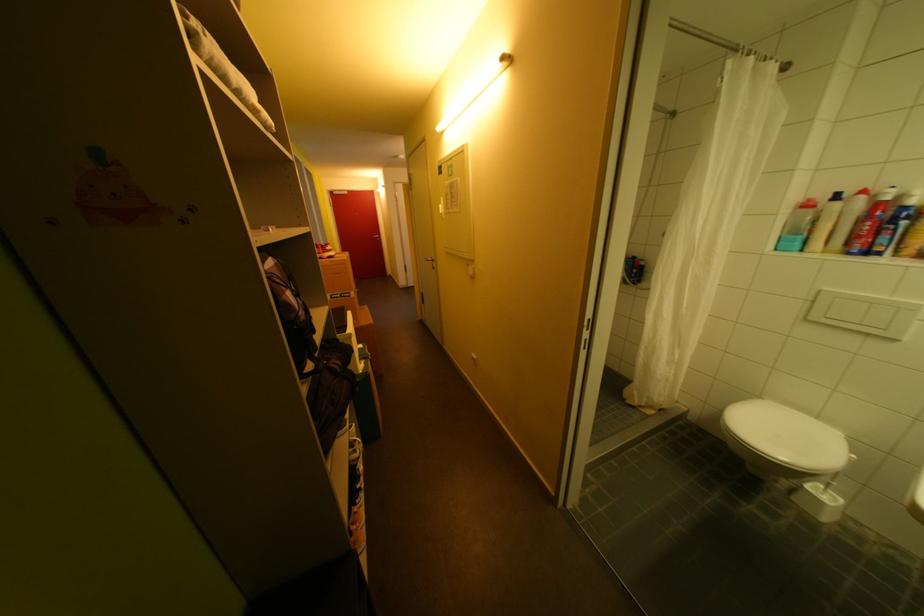
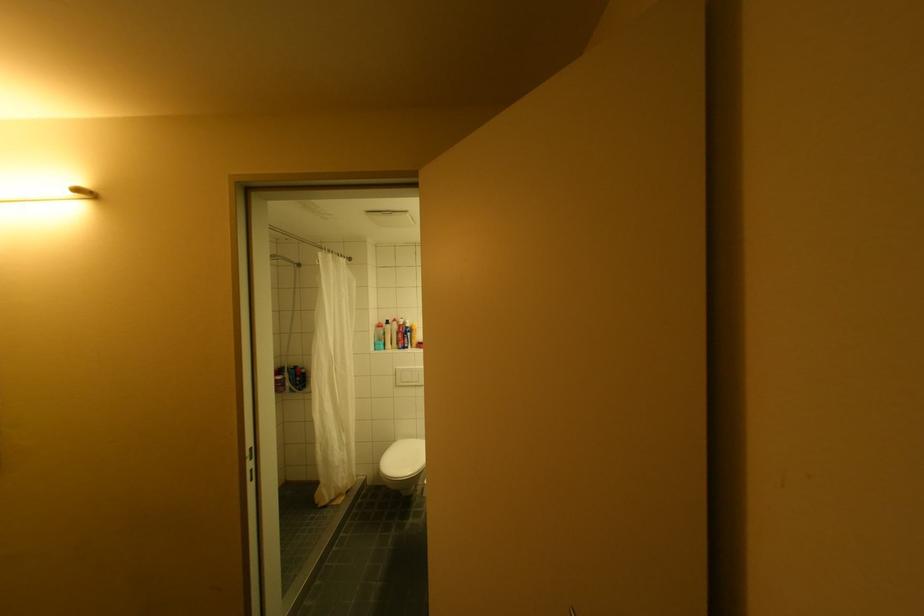
Question: The first image is from the beginning of the video and the second image is from the end. How did the camera likely rotate when shooting the video?

Choices:
 (A) Left
 (B) Right
 (C) Up
 (D) Down

Answer: (B)